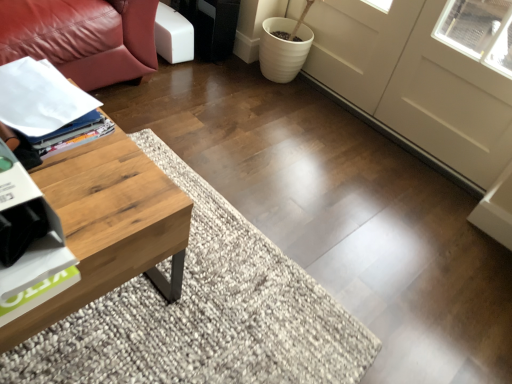
Question: Considering the positions of white glossy magazine at left and white matte screen door at center in the image, is white glossy magazine at left bigger or smaller than white matte screen door at center?

Choices:
 (A) big
 (B) small

Answer: (B)

Question: From the image's perspective, relative to white matte screen door at center, is white glossy magazine at left above or below?

Choices:
 (A) above
 (B) below

Answer: (B)

Question: Which of these objects is positioned closest to the white matte screen door at center?

Choices:
 (A) white glossy magazine at left
 (B) woodenmaterial/texturecoffee table at left

Answer: (A)

Question: Which object is the farthest from the white matte screen door at center?

Choices:
 (A) woodenmaterial/texturecoffee table at left
 (B) white glossy magazine at left

Answer: (A)